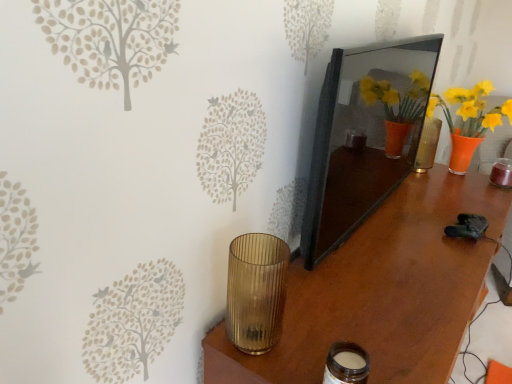
Question: Based on their positions, is gold ribbed glass at lower left, which appears as the 1th candle holder when viewed from the left, located to the left or right of matte black mirror at center?

Choices:
 (A) right
 (B) left

Answer: (B)

Question: Based on their sizes in the image, would you say gold ribbed glass at lower left, which appears as the 1th candle holder when viewed from the left, is bigger or smaller than matte black mirror at center?

Choices:
 (A) big
 (B) small

Answer: (B)

Question: Considering the real-world distances, which object is farthest from the brown wood table at center?

Choices:
 (A) gold ribbed glass at lower left, placed as the 2th candle holder when sorted from right to left
 (B) matte black mirror at center
 (C) matte glass jar at lower center, which appears as the second candle holder when viewed from the left

Answer: (C)

Question: Which object is the farthest from the brown wood table at center?

Choices:
 (A) gold ribbed glass at lower left, which appears as the 1th candle holder when viewed from the left
 (B) matte black mirror at center
 (C) matte glass jar at lower center, acting as the first candle holder starting from the right

Answer: (C)